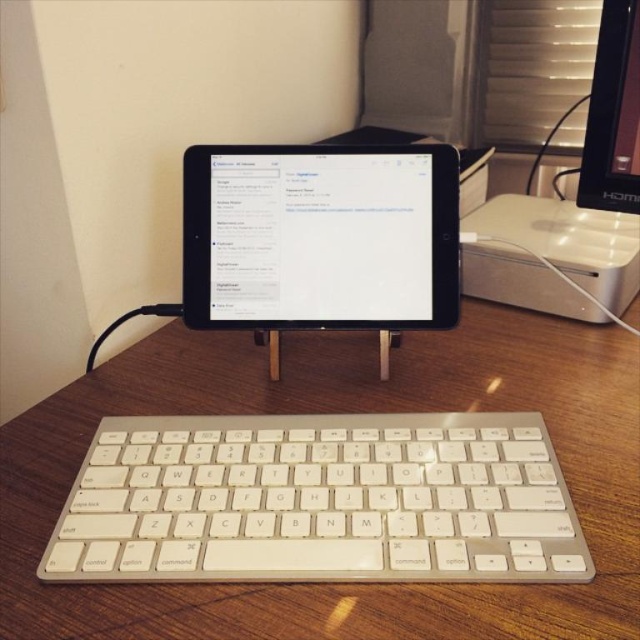
You are organizing a desk and need to place the black glossy tablet at center and the white plastic desktop computer at upper right. Based on their positions, which object is closer to the edge of the desk?

The white plastic desktop computer at upper right is closer to the edge of the desk since it is positioned above the black glossy tablet at center.

You are a delivery person who needs to place a small package on the wooden desk in the image. The package must be placed at the exact coordinates of point [330,410]. Is this point on the wooden desk?

Yes, the point [330,410] is on the wooden desk at center, so the package can be placed there.